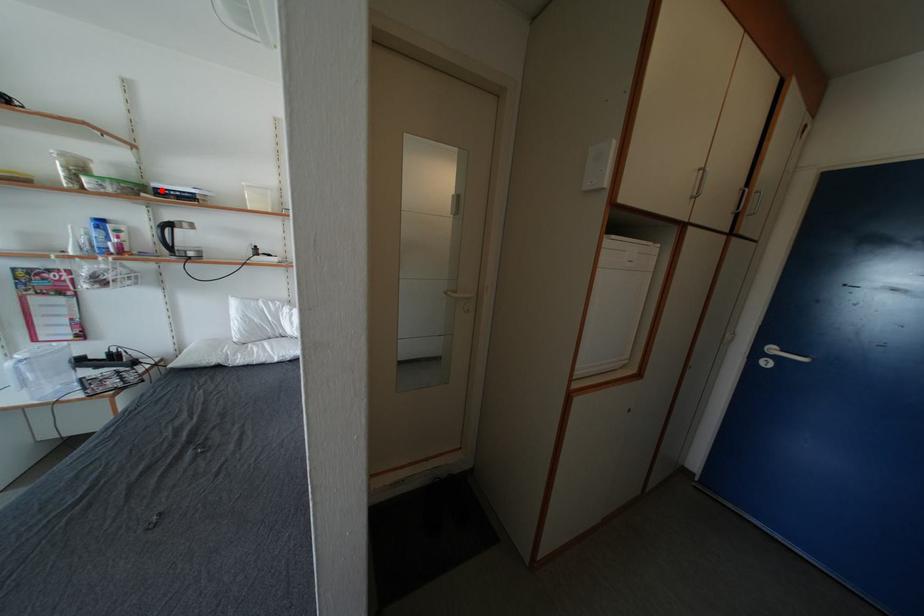
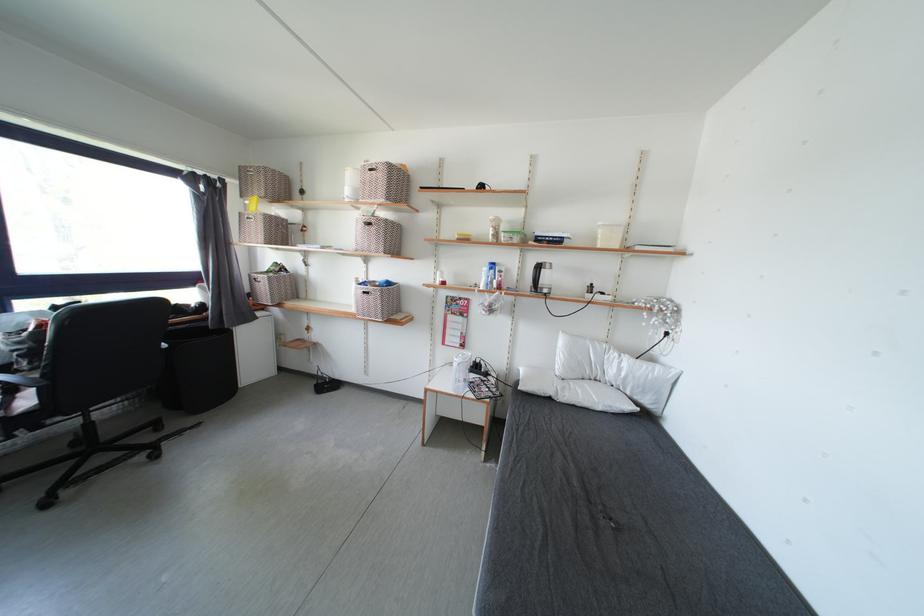
Question: I am providing you with two images of the same scene from different viewpoints. In image1, a red point is highlighted. Considering the same 3D point in image2, which of the following is correct?

Choices:
 (A) It is closer
 (B) It is farther

Answer: (A)